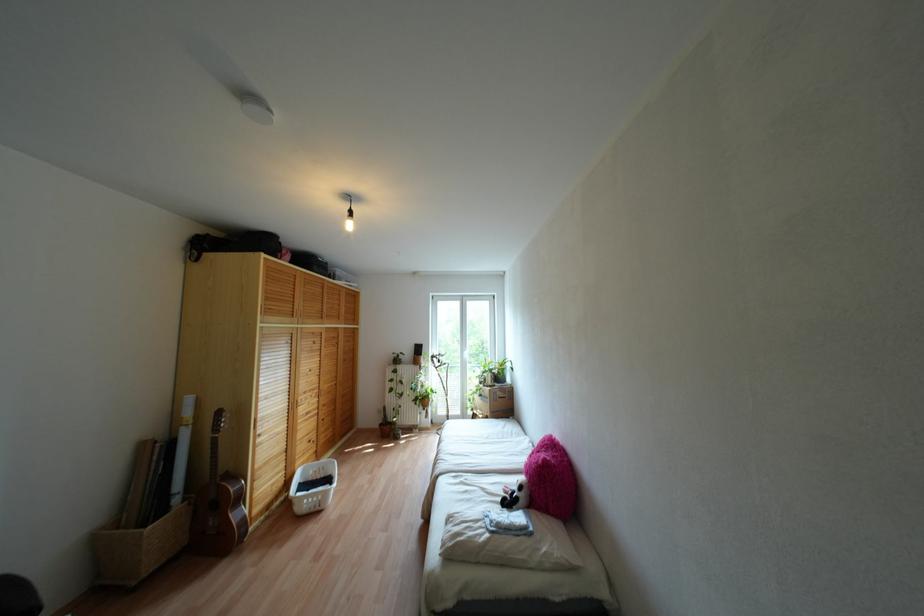
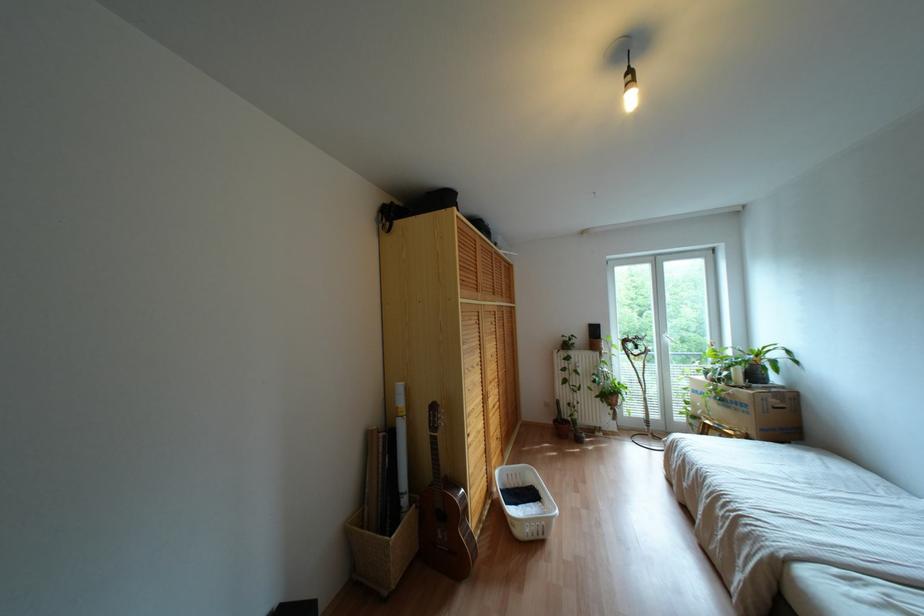
In a continuous first-person perspective shot, in which direction is the camera moving?

The cameraman walked toward left, forward.